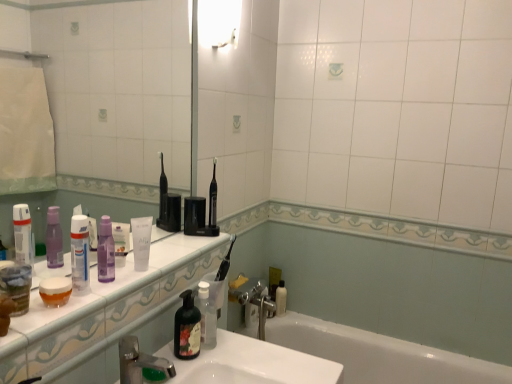
I want to click on free space between black plastic toothbrush at center and transparent plastic bottle at left, which is counted as the 1th toiletry, starting from the left, so click(157, 260).